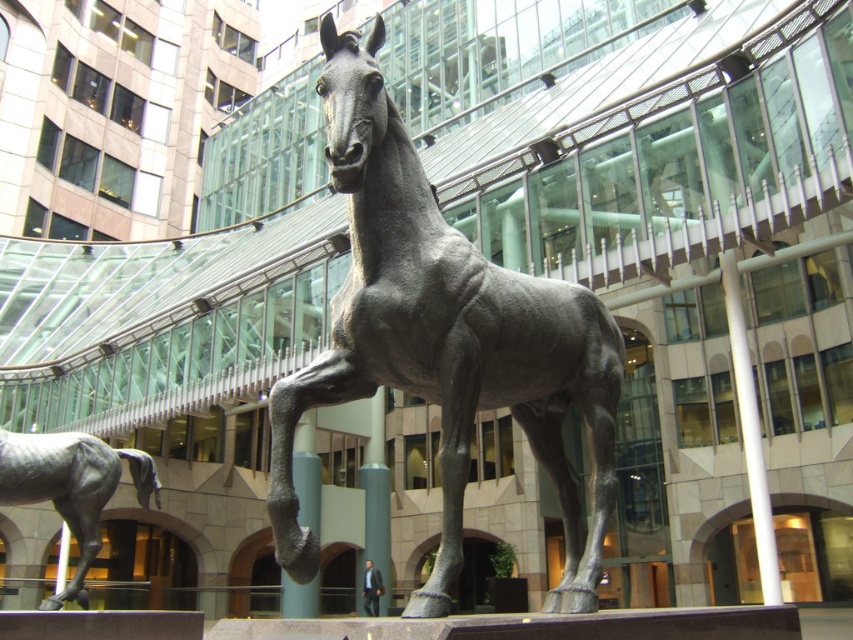
You are an art student analyzing the sculpture arrangement in the image. You notice two bronze horses. The first is labeled as the bronze horse at center, and the second is the polished bronze horse at lower left. Based on their sizes, which one do you think is the main focal point of the sculpture display?

The bronze horse at center is bigger than the polished bronze horse at lower left, so the bronze horse at center is the main focal point of the sculpture display.

You are an urban planner assessing the space between the bronze horse at center and the polished white pole at center. If you want to place a 1.2 meter wide bench between them, will there be enough space?

The bronze horse at center might be wider than the polished white pole at center, so it is uncertain if there is enough space for a 1.2 meter wide bench between them without knowing their exact widths.

You are an urban planner assessing the space between the polished bronze horse at lower left and the polished white pole at center. If you want to place a 1.2 meter wide bench between them, will there be enough space?

The polished bronze horse at lower left is wider than the polished white pole at center. However, the exact distance between them isn